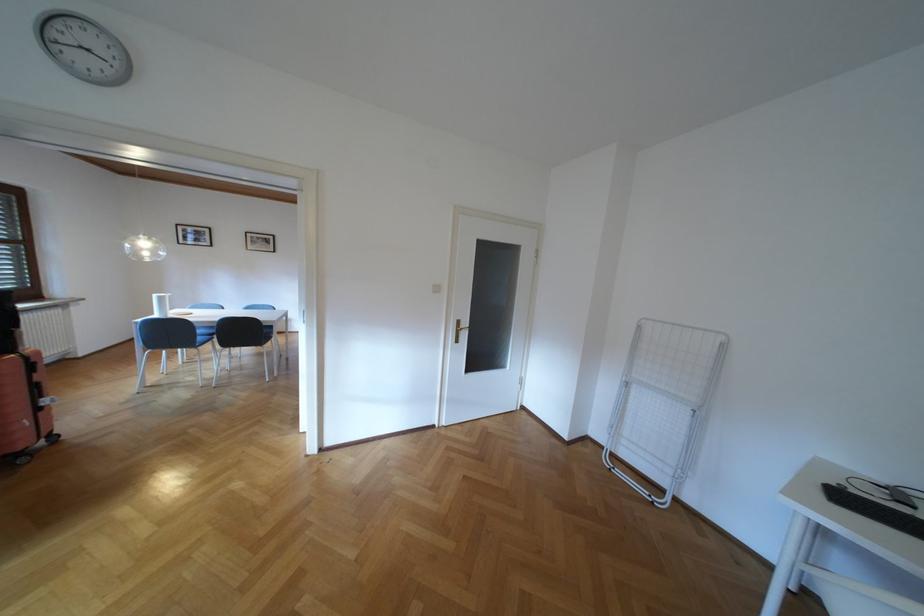
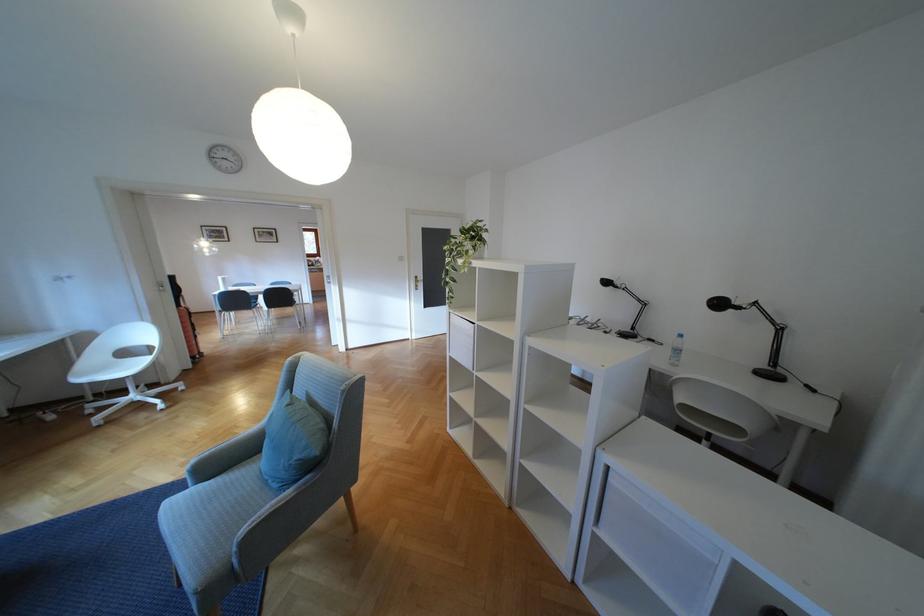
Question: Which direction would the cameraman need to move to produce the second image? Reply with the corresponding letter.

Choices:
 (A) Left
 (B) Right
 (C) Forward
 (D) Backward

Answer: (D)